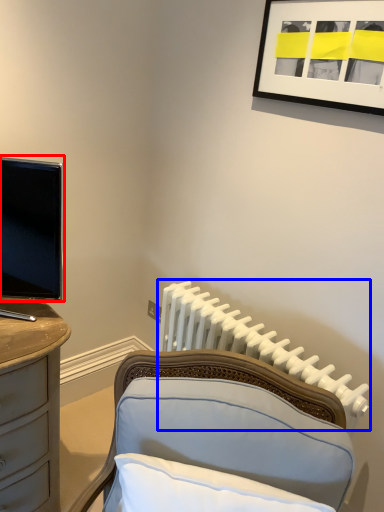
Question: Among these objects, which one is farthest to the camera, television (highlighted by a red box) or radiator (highlighted by a blue box)?

Choices:
 (A) television
 (B) radiator

Answer: (B)